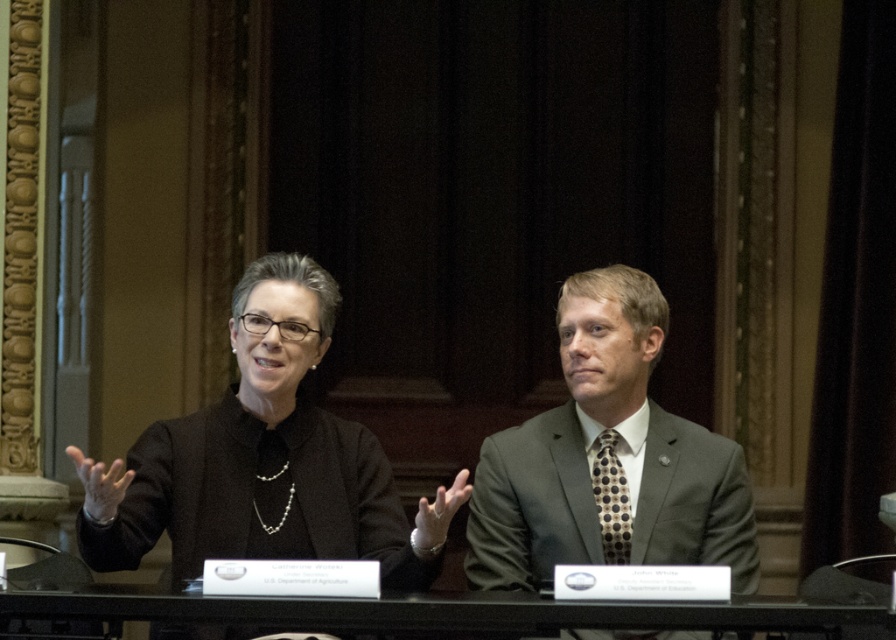
Between point (248, 506) and point (563, 440), which one is positioned in front?

Positioned in front is point (248, 506).

Is black matte blazer at center closer to camera compared to dark gray suit at center?

Yes, it is in front of dark gray suit at center.

Locate an element on the screen. The image size is (896, 640). black matte blazer at center is located at coordinates (263, 460).

Based on the photo, measure the distance from dark gray suit at center to black glass table at center.

dark gray suit at center and black glass table at center are 5.60 feet apart from each other.

Describe the element at coordinates (608, 460) in the screenshot. I see `dark gray suit at center` at that location.

Where is `dark gray suit at center`? The width and height of the screenshot is (896, 640). dark gray suit at center is located at coordinates (608, 460).

Can you confirm if black matte blazer at center is shorter than black glass table at center?

In fact, black matte blazer at center may be taller than black glass table at center.

Who is more forward, (342, 444) or (582, 608)?

Point (582, 608)

Who is more forward, (x=278, y=493) or (x=240, y=598)?

Positioned in front is point (x=240, y=598).

Find the location of a particular element. This screenshot has width=896, height=640. black matte blazer at center is located at coordinates (263, 460).